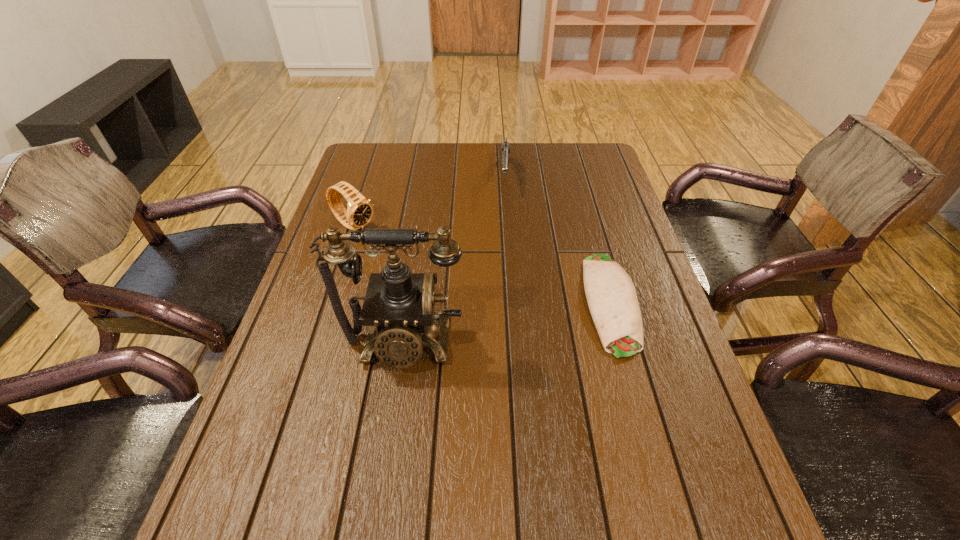
Locate an element on the screen. free location at the near edge of the desktop is located at coordinates (515, 446).

I want to click on vacant space at the left edge of the desktop, so click(334, 266).

The width and height of the screenshot is (960, 540). In the image, there is a desktop. Identify the location of vacant space at the right edge. (667, 344).

The width and height of the screenshot is (960, 540). I want to click on vacant space at the far left corner of the desktop, so click(x=387, y=149).

Image resolution: width=960 pixels, height=540 pixels. I want to click on free space at the far right corner of the desktop, so click(x=562, y=156).

Where is `empty space between the third tallest object and the third shortest object`? empty space between the third tallest object and the third shortest object is located at coordinates (429, 201).

At what (x,y) coordinates should I click in order to perform the action: click on vacant area that lies between the rightmost object and the second object from right to left. Please return your answer as a coordinate pair (x, y). Image resolution: width=960 pixels, height=540 pixels. Looking at the image, I should click on (558, 239).

Where is `vacant area that lies between the shortest object and the telephone`? The image size is (960, 540). vacant area that lies between the shortest object and the telephone is located at coordinates (507, 323).

At what (x,y) coordinates should I click in order to perform the action: click on free spot between the telephone and the shortest object. Please return your answer as a coordinate pair (x, y). Looking at the image, I should click on (507, 323).

This screenshot has height=540, width=960. Find the location of `free space between the farthest object and the burrito`. free space between the farthest object and the burrito is located at coordinates (558, 239).